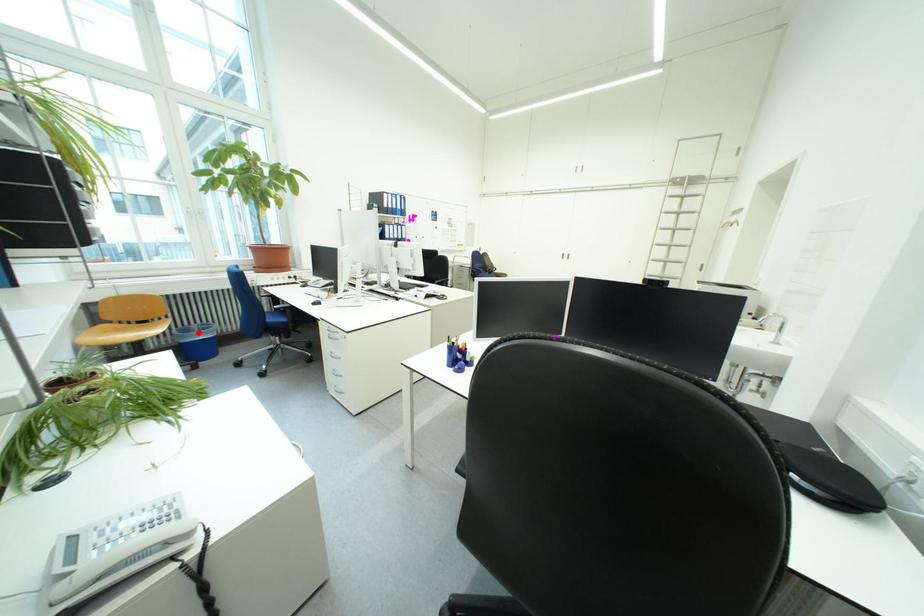
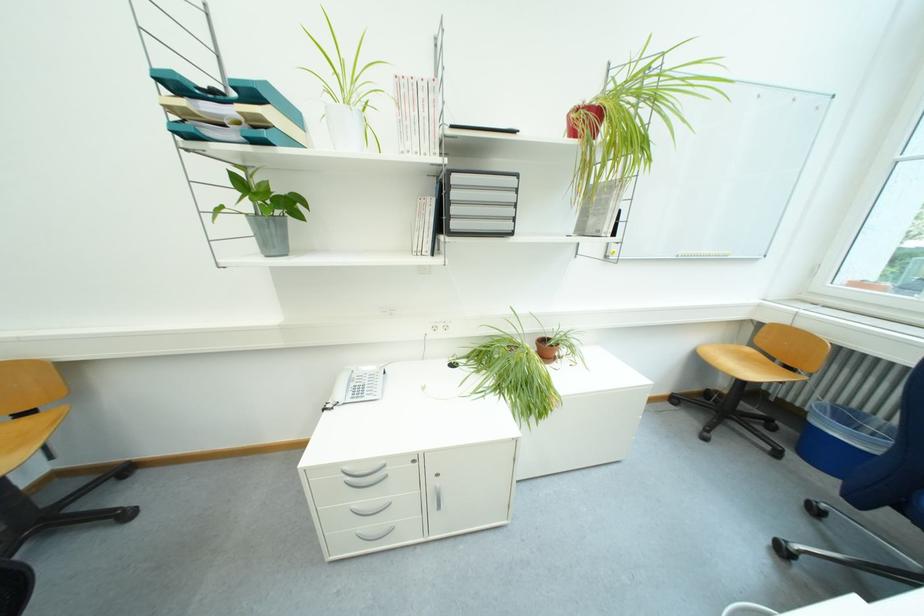
Question: I am providing you with two images of the same scene from different viewpoints. A red point is marked on the first image. Is the red point's position out of view in image 2?

Choices:
 (A) Yes
 (B) No

Answer: (B)